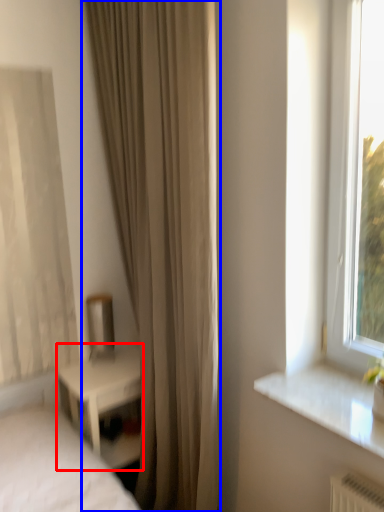
Question: Which object appears farthest to the camera in this image, nightstand (highlighted by a red box) or curtain (highlighted by a blue box)?

Choices:
 (A) nightstand
 (B) curtain

Answer: (A)